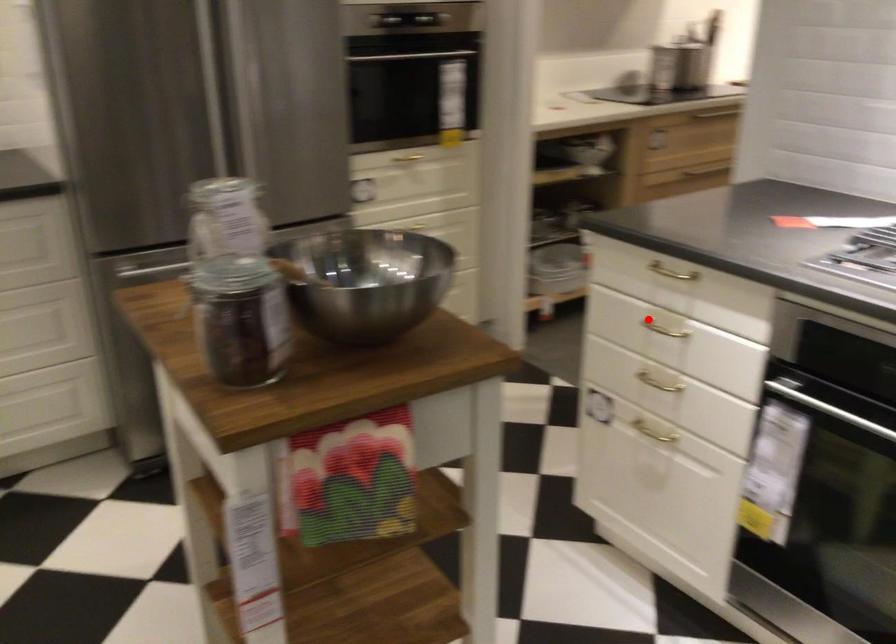
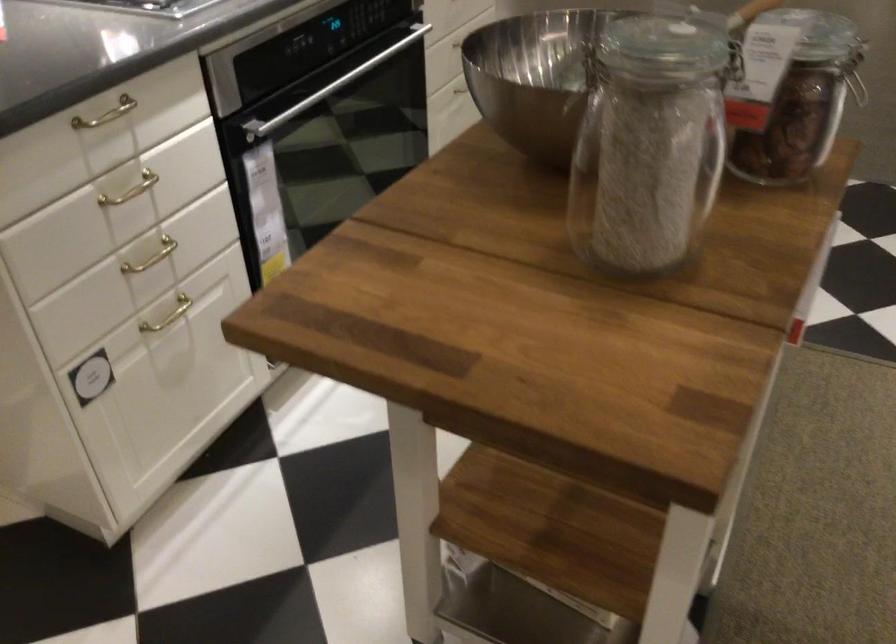
Find the pixel in the second image that matches the highlighted location in the first image.

(131, 190)